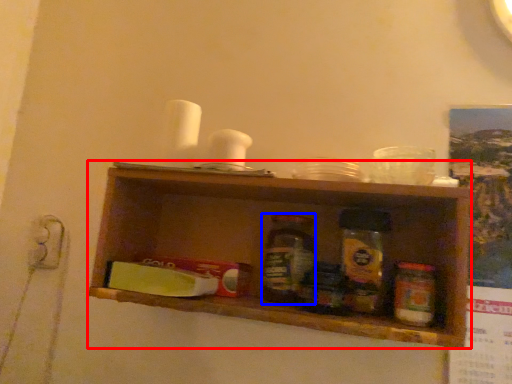
Question: Which of the following is the farthest to the observer, shelf (highlighted by a red box) or bottle (highlighted by a blue box)?

Choices:
 (A) shelf
 (B) bottle

Answer: (B)